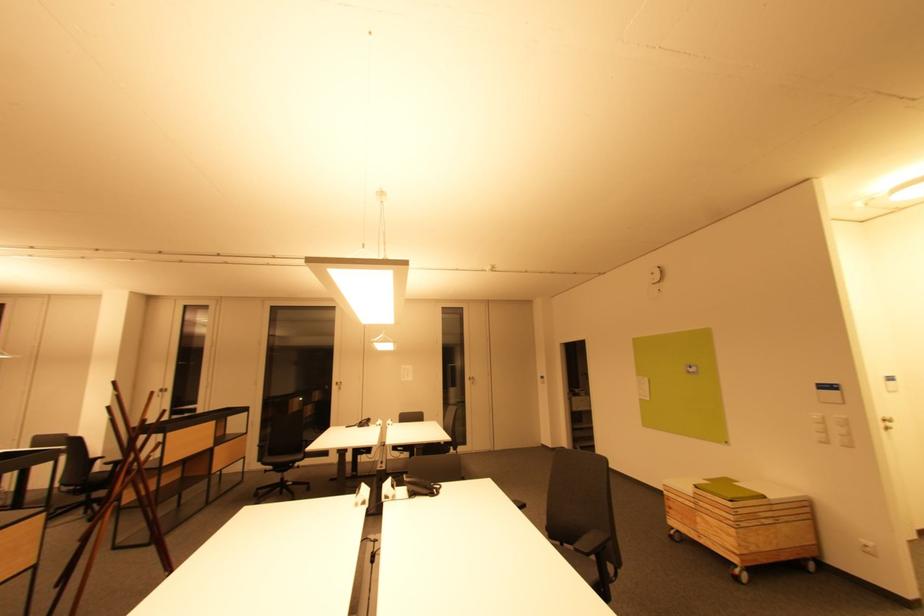
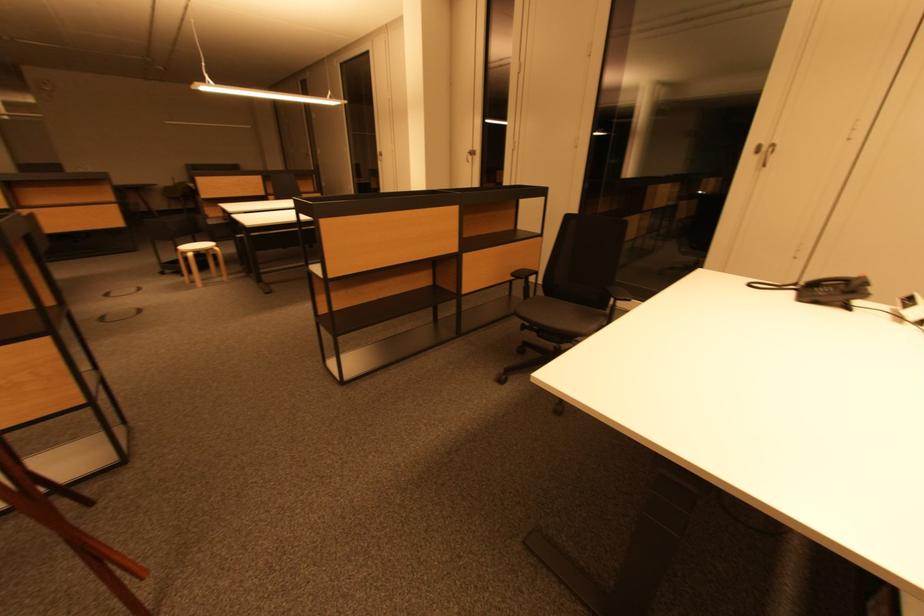
The point at (x=383, y=426) is marked in the first image. Where is the corresponding point in the second image?

(918, 320)